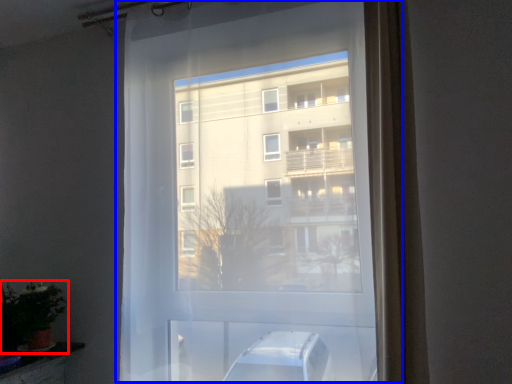
Question: Which object is closer to the camera taking this photo, houseplant (highlighted by a red box) or window (highlighted by a blue box)?

Choices:
 (A) houseplant
 (B) window

Answer: (B)